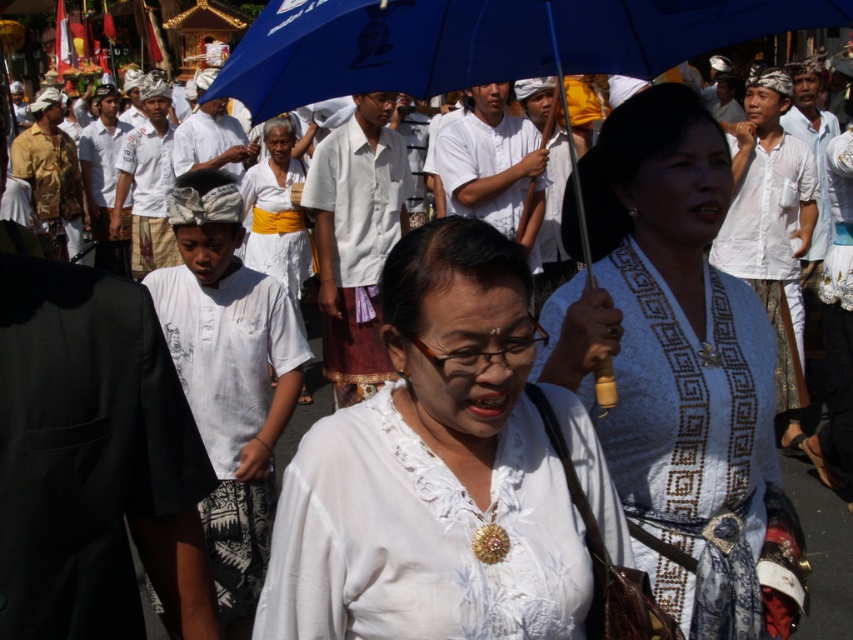
You are a photographer trying to capture the woman in the white lace blouse at center and the blue fabric umbrella at upper center in the same frame. Based on their positions, which object is closer to the camera?

The white lace blouse at center is below the blue fabric umbrella at upper center, meaning the umbrella is higher in the frame. Since the umbrella is at upper center and the blouse is below it, the blue fabric umbrella at upper center is closer to the camera.

You are a photographer standing at the edge of the cultural procession. You want to take a closeup shot of the white lace blouse at center. Considering your camera can focus on subjects within 1.5 meters, will you be able to capture the blouse clearly?

The white lace blouse at center is 1.89 meters away from the viewer. Since your camera can focus within 1.5 meters, you are too far to capture it clearly. Move closer to within 1.5 meters for a sharp image.